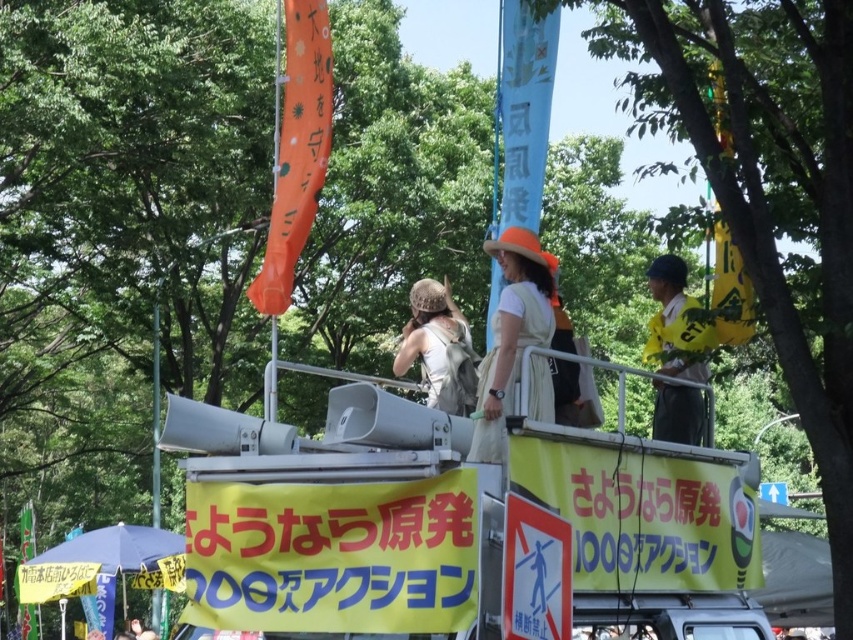
Is matte orange hat at center above metallic pole at center?

Yes.

Image resolution: width=853 pixels, height=640 pixels. I want to click on matte orange hat at center, so click(515, 308).

Who is positioned more to the left, blue fabric canopy at lower left or metallic pole at center?

From the viewer's perspective, metallic pole at center appears more on the left side.

Can you confirm if blue fabric canopy at lower left is taller than metallic pole at center?

No.

Is point (36, 556) farther from viewer compared to point (158, 497)?

Yes, it is.

Locate an element on the screen. blue fabric canopy at lower left is located at coordinates (115, 547).

Which of these two, yellow fabric shirt at right or blue fabric canopy at lower left, stands taller?

With more height is blue fabric canopy at lower left.

Which is in front, point (683, 433) or point (129, 563)?

Point (683, 433) is in front.

Find the location of `yellow fabric shirt at right`. yellow fabric shirt at right is located at coordinates (677, 413).